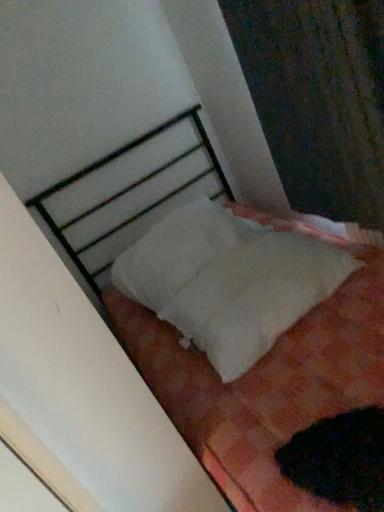
Question: From a real-world perspective, relative to white soft fabric at center, is black fuzzy cat at lower right vertically above or below?

Choices:
 (A) below
 (B) above

Answer: (A)

Question: Considering the positions of black fuzzy cat at lower right and white soft fabric at center in the image, is black fuzzy cat at lower right wider or thinner than white soft fabric at center?

Choices:
 (A) thin
 (B) wide

Answer: (A)

Question: Which of these objects is positioned farthest from the black fuzzy cat at lower right?

Choices:
 (A) white soft fabric at center
 (B) white soft pillow at center
 (C) white fabric curtain at upper right

Answer: (C)

Question: Based on their relative distances, which object is nearer to the white fabric curtain at upper right?

Choices:
 (A) black fuzzy cat at lower right
 (B) white soft pillow at center
 (C) white soft fabric at center

Answer: (C)